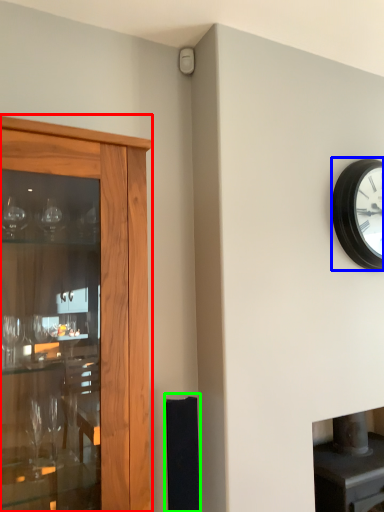
Question: Considering the real-world distances, which object is closest to cupboard (highlighted by a red box)? wall clock (highlighted by a blue box) or speaker (highlighted by a green box).

Choices:
 (A) wall clock
 (B) speaker

Answer: (B)